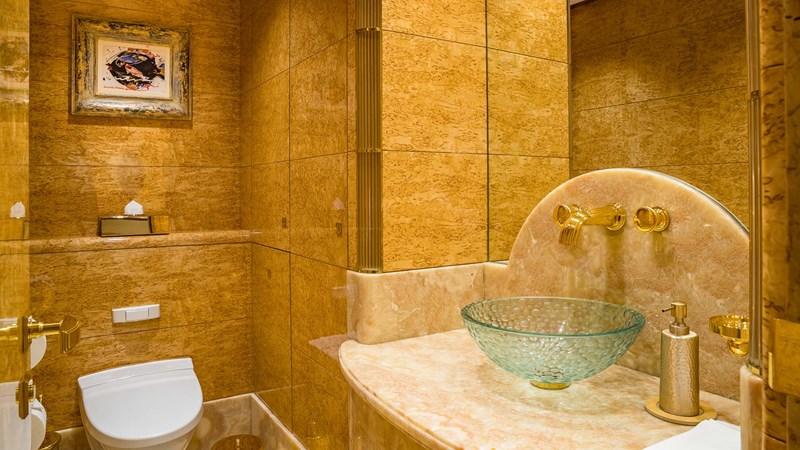
I want to click on trash can, so click(x=240, y=441).